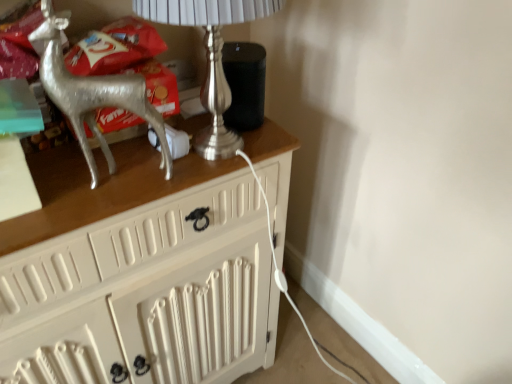
The height and width of the screenshot is (384, 512). Describe the element at coordinates (92, 94) in the screenshot. I see `silver metallic reindeer at left` at that location.

The height and width of the screenshot is (384, 512). I want to click on silver metallic reindeer at left, so click(x=92, y=94).

What is the approximate height of silver metallic reindeer at left?

The height of silver metallic reindeer at left is 13.01 inches.

The width and height of the screenshot is (512, 384). Describe the element at coordinates (210, 57) in the screenshot. I see `silver metallic table lamp at upper left` at that location.

Find the location of a particular element. The image size is (512, 384). silver metallic table lamp at upper left is located at coordinates (210, 57).

Where is `silver metallic reindeer at left`? The height and width of the screenshot is (384, 512). silver metallic reindeer at left is located at coordinates (92, 94).

Is silver metallic reindeer at left to the left of silver metallic table lamp at upper left from the viewer's perspective?

Indeed, silver metallic reindeer at left is positioned on the left side of silver metallic table lamp at upper left.

Is silver metallic reindeer at left positioned before silver metallic table lamp at upper left?

That is True.

Considering the positions of point (47, 30) and point (219, 72), is point (47, 30) closer or farther from the camera than point (219, 72)?

Clearly, point (47, 30) is closer to the camera than point (219, 72).

From the image's perspective, is silver metallic reindeer at left beneath silver metallic table lamp at upper left?

Yes, from the image's perspective, silver metallic reindeer at left is beneath silver metallic table lamp at upper left.

From a real-world perspective, who is located higher, silver metallic reindeer at left or silver metallic table lamp at upper left?

From a 3D spatial view, silver metallic reindeer at left is above.

Considering the sizes of objects silver metallic reindeer at left and silver metallic table lamp at upper left in the image provided, who is thinner, silver metallic reindeer at left or silver metallic table lamp at upper left?

With smaller width is silver metallic reindeer at left.

Is silver metallic reindeer at left taller than silver metallic table lamp at upper left?

Yes, silver metallic reindeer at left is taller than silver metallic table lamp at upper left.

Can you confirm if silver metallic reindeer at left is bigger than silver metallic table lamp at upper left?

→ No, silver metallic reindeer at left is not bigger than silver metallic table lamp at upper left.

Can we say silver metallic reindeer at left lies outside silver metallic table lamp at upper left?

Indeed, silver metallic reindeer at left is completely outside silver metallic table lamp at upper left.

Is silver metallic reindeer at left positioned far away from silver metallic table lamp at upper left?

silver metallic reindeer at left is near silver metallic table lamp at upper left, not far away.

Does silver metallic reindeer at left turn towards silver metallic table lamp at upper left?

No, silver metallic reindeer at left is not turned towards silver metallic table lamp at upper left.

Can you tell me how much silver metallic reindeer at left and silver metallic table lamp at upper left differ in facing direction?

They differ by 1.3 degrees in their facing directions.

Where is `table lamp below the silver metallic reindeer at left (from a real-world perspective)`? The width and height of the screenshot is (512, 384). table lamp below the silver metallic reindeer at left (from a real-world perspective) is located at coordinates (210, 57).

Visually, is silver metallic table lamp at upper left positioned to the left or to the right of silver metallic reindeer at left?

From the image, it's evident that silver metallic table lamp at upper left is to the right of silver metallic reindeer at left.

Is silver metallic table lamp at upper left closer to camera compared to silver metallic reindeer at left?

No, it is behind silver metallic reindeer at left.

Is point (170, 0) closer or farther from the camera than point (153, 128)?

Clearly, point (170, 0) is closer to the camera than point (153, 128).

From the image's perspective, which one is positioned lower, silver metallic table lamp at upper left or silver metallic reindeer at left?

silver metallic reindeer at left.

From a real-world perspective, between silver metallic table lamp at upper left and silver metallic reindeer at left, who is vertically higher?

From a 3D spatial view, silver metallic reindeer at left is above.

Is silver metallic table lamp at upper left wider or thinner than silver metallic reindeer at left?

silver metallic table lamp at upper left is wider than silver metallic reindeer at left.

Who is taller, silver metallic table lamp at upper left or silver metallic reindeer at left?

Standing taller between the two is silver metallic reindeer at left.

Looking at this image, can you confirm if silver metallic table lamp at upper left is bigger than silver metallic reindeer at left?

Yes, silver metallic table lamp at upper left is bigger than silver metallic reindeer at left.

Based on the photo, is silver metallic table lamp at upper left positioned beyond the bounds of silver metallic reindeer at left?

That's correct, silver metallic table lamp at upper left is outside of silver metallic reindeer at left.

Does silver metallic table lamp at upper left touch silver metallic reindeer at left?

No.

Is silver metallic table lamp at upper left facing towards silver metallic reindeer at left?

No, silver metallic table lamp at upper left does not turn towards silver metallic reindeer at left.

How distant is silver metallic table lamp at upper left from silver metallic reindeer at left?

silver metallic table lamp at upper left is 6.44 inches away from silver metallic reindeer at left.

The image size is (512, 384). Find the location of `table lamp below the silver metallic reindeer at left (from a real-world perspective)`. table lamp below the silver metallic reindeer at left (from a real-world perspective) is located at coordinates (210, 57).

Locate an element on the screen. The height and width of the screenshot is (384, 512). reindeer located above the silver metallic table lamp at upper left (from a real-world perspective) is located at coordinates (92, 94).

Locate an element on the screen. The width and height of the screenshot is (512, 384). reindeer in front of the silver metallic table lamp at upper left is located at coordinates (92, 94).